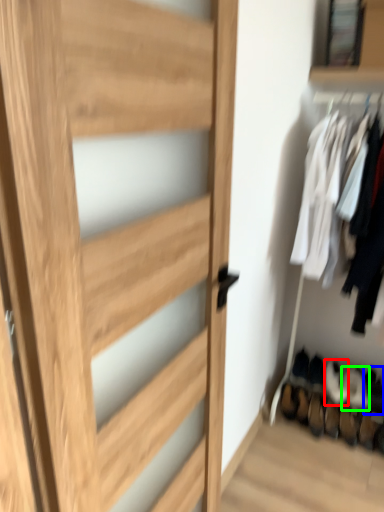
Question: Considering the real-world distances, which object is farthest from shoe (highlighted by a red box)? shoe (highlighted by a blue box) or shoe (highlighted by a green box)?

Choices:
 (A) shoe
 (B) shoe

Answer: (A)